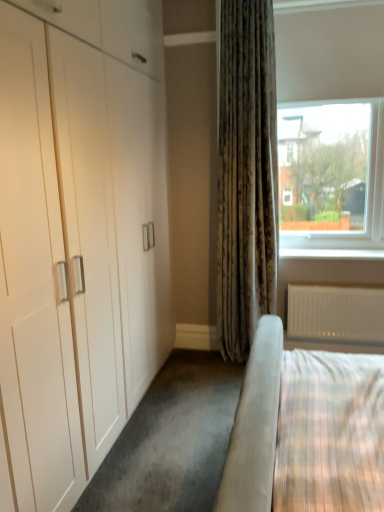
What do you see at coordinates (332, 175) in the screenshot?
I see `clear glass window at upper right` at bounding box center [332, 175].

Locate an element on the screen. white textured radiator at lower right is located at coordinates (336, 313).

You are a GUI agent. You are given a task and a screenshot of the screen. Output one action in this format:
    pyautogui.click(x=<x>, y=<y>)
    Task: Click on the clear glass window at upper right
    
    Given the screenshot: What is the action you would take?
    pyautogui.click(x=332, y=175)

Is clear glass window at upper right oriented towards white textured radiator at lower right?

No, clear glass window at upper right does not turn towards white textured radiator at lower right.

Is clear glass window at upper right smaller than white textured radiator at lower right?

No.

Locate an element on the screen. This screenshot has height=512, width=384. radiator beneath the clear glass window at upper right (from a real-world perspective) is located at coordinates (336, 313).

Looking at this image, considering the relative sizes of clear glass window at upper right and white textured radiator at lower right in the image provided, is clear glass window at upper right taller than white textured radiator at lower right?

Indeed, clear glass window at upper right has a greater height compared to white textured radiator at lower right.

In the scene shown: Is clear glass window at upper right aimed at white smooth window sill at lower right?

No, clear glass window at upper right is not facing towards white smooth window sill at lower right.

Is clear glass window at upper right located outside white smooth window sill at lower right?

Absolutely, clear glass window at upper right is external to white smooth window sill at lower right.

Where is `window sill located behind the clear glass window at upper right`? The image size is (384, 512). window sill located behind the clear glass window at upper right is located at coordinates pos(332,253).

Considering the relative sizes of white smooth window sill at lower right and white textured radiator at lower right in the image provided, is white smooth window sill at lower right smaller than white textured radiator at lower right?

Yes, white smooth window sill at lower right is smaller than white textured radiator at lower right.

How different are the orientations of white smooth window sill at lower right and white textured radiator at lower right in degrees?

The facing directions of white smooth window sill at lower right and white textured radiator at lower right are 0.895 degrees apart.

Is point (336, 258) behind point (354, 329)?

Yes, it is behind point (354, 329).

Is white smooth window sill at lower right located within white textured radiator at lower right?

No.

From the image's perspective, between white textured radiator at lower right and white smooth window sill at lower right, which one is located above?

From the image's view, white smooth window sill at lower right is above.

Looking at this image, considering the positions of objects white textured radiator at lower right and white smooth window sill at lower right in the image provided, who is behind, white textured radiator at lower right or white smooth window sill at lower right?

white smooth window sill at lower right is further away from the camera.

Would you say white smooth window sill at lower right is outside clear glass window at upper right?

That's incorrect, white smooth window sill at lower right is not completely outside clear glass window at upper right.

Which object is positioned more to the left, white smooth window sill at lower right or clear glass window at upper right?

clear glass window at upper right is more to the left.

Considering the sizes of white smooth window sill at lower right and clear glass window at upper right in the image, is white smooth window sill at lower right taller or shorter than clear glass window at upper right?

white smooth window sill at lower right is shorter than clear glass window at upper right.

Is white textured radiator at lower right spatially inside clear glass window at upper right, or outside of it?

white textured radiator at lower right exists outside the volume of clear glass window at upper right.

At what (x,y) coordinates should I click in order to perform the action: click on window in front of the white textured radiator at lower right. Please return your answer as a coordinate pair (x, y). Looking at the image, I should click on (332, 175).

Which of these two, white textured radiator at lower right or clear glass window at upper right, is thinner?

With smaller width is white textured radiator at lower right.

From the image's perspective, which one is positioned lower, white textured radiator at lower right or clear glass window at upper right?

white textured radiator at lower right, from the image's perspective.

The image size is (384, 512). I want to click on radiator behind the clear glass window at upper right, so (x=336, y=313).

What are the coordinates of `window that appears above the white smooth window sill at lower right (from a real-world perspective)` in the screenshot? It's located at (332, 175).

Looking at the image, which one is located closer to clear glass window at upper right, white smooth window sill at lower right or white textured radiator at lower right?

white smooth window sill at lower right is positioned closer to the anchor clear glass window at upper right.

Based on their spatial positions, is clear glass window at upper right or white textured radiator at lower right further from white smooth window sill at lower right?

clear glass window at upper right.

Based on their spatial positions, is clear glass window at upper right or white smooth window sill at lower right closer to white textured radiator at lower right?

white smooth window sill at lower right is closer to white textured radiator at lower right.

When comparing their distances from clear glass window at upper right, does white textured radiator at lower right or white smooth window sill at lower right seem closer?

Among the two, white smooth window sill at lower right is located nearer to clear glass window at upper right.

Based on their spatial positions, is white smooth window sill at lower right or clear glass window at upper right further from white textured radiator at lower right?

clear glass window at upper right.

Considering their positions, is white textured radiator at lower right positioned further to white smooth window sill at lower right than clear glass window at upper right?

Among the two, clear glass window at upper right is located further to white smooth window sill at lower right.

This screenshot has width=384, height=512. What are the coordinates of `window sill that lies between clear glass window at upper right and white textured radiator at lower right from top to bottom` in the screenshot? It's located at (332, 253).